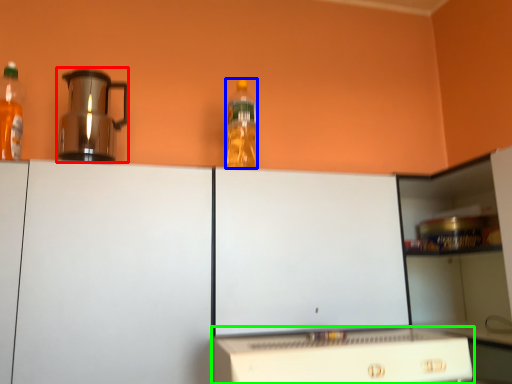
Question: Based on their relative distances, which object is farther from kitchen appliance (highlighted by a red box)? Choose from bottle (highlighted by a blue box) and home appliance (highlighted by a green box).

Choices:
 (A) bottle
 (B) home appliance

Answer: (B)